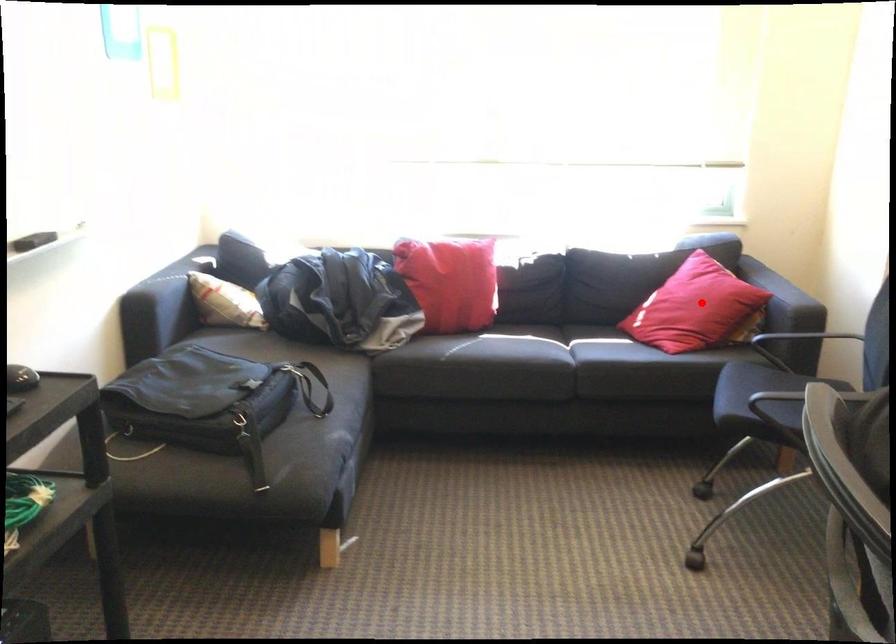
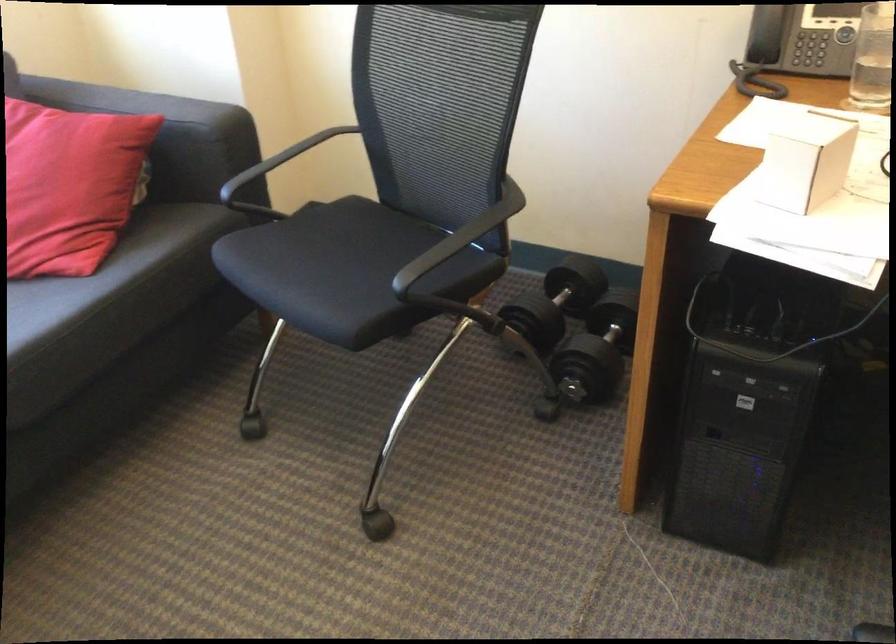
Question: I am providing you with two images of the same scene from different viewpoints. Given a red point in image1, look at the same physical point in image2. Is it:

Choices:
 (A) Closer to the viewpoint
 (B) Farther from the viewpoint

Answer: (A)